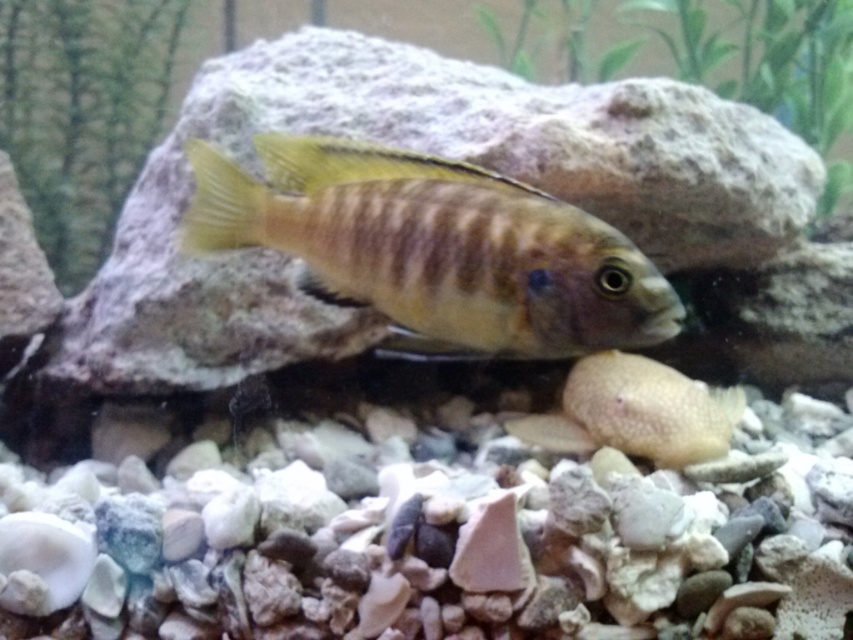
You are an aquatic robot with a body length of 20 inches. You need to move from the shiny brown fish at center to the smooth beige rock at center. Can you fit through the space between them without touching either?

The distance between the shiny brown fish at center and the smooth beige rock at center is 22.87 inches. Since the robot is 20 inches long, it can fit through the space between them without touching either.

You are an aquatic maintenance robot tasked with cleaning the fish tank. You need to navigate between the shiny brown fish at center and the smooth beige rock at center. Based on their sizes, which object will require more space for the robot to maneuver around?

The shiny brown fish at center has a greater width than the smooth beige rock at center, so the robot will need more space to maneuver around the shiny brown fish at center.

You are a robotic arm positioned at the bottom of the fish tank. You need to move a small pebble from the pebbles in front of the rock to the shiny brown fish at center. What coordinate should you aim for to place the pebble near the fish?

The shiny brown fish at center is located at coordinates point (434, 248), so you should aim for that point to place the pebble near it.